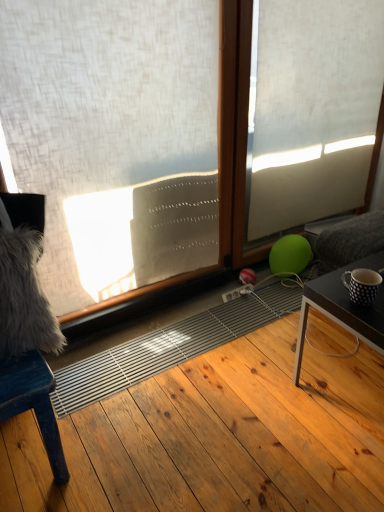
Question: From a real-world perspective, does dark brown wooden table at lower right stand above wooden chair at left?

Choices:
 (A) yes
 (B) no

Answer: (B)

Question: Is dark brown wooden table at lower right smaller than wooden chair at left?

Choices:
 (A) no
 (B) yes

Answer: (B)

Question: Can you confirm if dark brown wooden table at lower right is taller than wooden chair at left?

Choices:
 (A) yes
 (B) no

Answer: (B)

Question: Is dark brown wooden table at lower right at the right side of wooden chair at left?

Choices:
 (A) no
 (B) yes

Answer: (B)

Question: Is dark brown wooden table at lower right wider than wooden chair at left?

Choices:
 (A) yes
 (B) no

Answer: (B)

Question: From their relative heights in the image, would you say wooden frame at center is taller or shorter than natural wood floor at center?

Choices:
 (A) tall
 (B) short

Answer: (A)

Question: Is wooden frame at center bigger or smaller than natural wood floor at center?

Choices:
 (A) small
 (B) big

Answer: (A)

Question: From the image's perspective, is wooden frame at center located above or below natural wood floor at center?

Choices:
 (A) below
 (B) above

Answer: (B)

Question: Choose the correct answer: Is wooden frame at center inside natural wood floor at center or outside it?

Choices:
 (A) inside
 (B) outside

Answer: (B)

Question: Choose the correct answer: Is polka dot ceramic mug at right inside natural wood floor at center or outside it?

Choices:
 (A) outside
 (B) inside

Answer: (A)

Question: In the image, is polka dot ceramic mug at right positioned in front of or behind natural wood floor at center?

Choices:
 (A) behind
 (B) front

Answer: (A)

Question: Is polka dot ceramic mug at right wider or thinner than natural wood floor at center?

Choices:
 (A) thin
 (B) wide

Answer: (A)

Question: From a real-world perspective, is polka dot ceramic mug at right above or below natural wood floor at center?

Choices:
 (A) below
 (B) above

Answer: (B)

Question: From the image's perspective, is wooden chair at left located above or below wooden frame at center?

Choices:
 (A) above
 (B) below

Answer: (B)

Question: From their relative heights in the image, would you say wooden chair at left is taller or shorter than wooden frame at center?

Choices:
 (A) tall
 (B) short

Answer: (B)